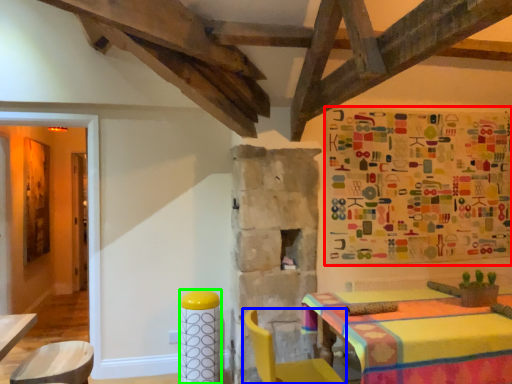
Question: Considering the real-world distances, which object is closest to tapestry (highlighted by a red box)? chair (highlighted by a blue box) or bar stool (highlighted by a green box).

Choices:
 (A) chair
 (B) bar stool

Answer: (A)